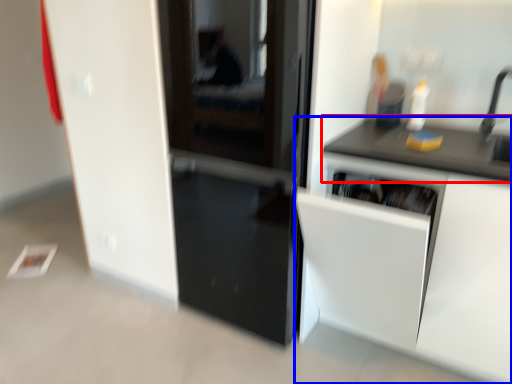
Question: Among these objects, which one is farthest to the camera, countertop (highlighted by a red box) or cabinetry (highlighted by a blue box)?

Choices:
 (A) countertop
 (B) cabinetry

Answer: (A)